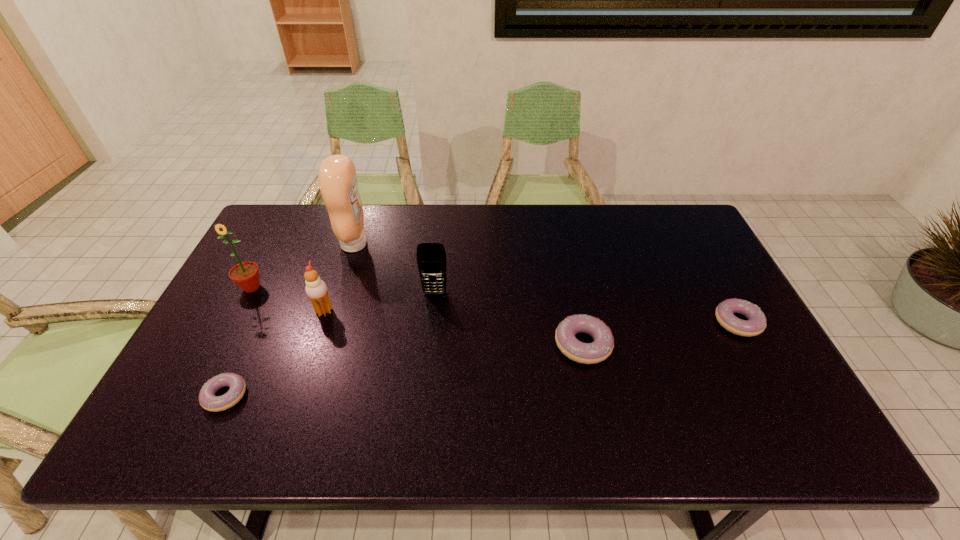
Find the location of a particular element. The width and height of the screenshot is (960, 540). icecream is located at coordinates (316, 289).

Where is `vacant space situated on the back of the nearest doughnut`? vacant space situated on the back of the nearest doughnut is located at coordinates (274, 292).

I want to click on vacant space located on the back of the sixth object from left to right, so click(x=573, y=298).

At what (x,y) coordinates should I click in order to perform the action: click on vacant position located on the left of the rightmost object. Please return your answer as a coordinate pair (x, y). The width and height of the screenshot is (960, 540). Looking at the image, I should click on (663, 322).

At what (x,y) coordinates should I click in order to perform the action: click on free location located on the face of the sixth shortest object. Please return your answer as a coordinate pair (x, y). Looking at the image, I should click on (237, 315).

At what (x,y) coordinates should I click in order to perform the action: click on free space located 0.370m on the label of the tallest object. Please return your answer as a coordinate pair (x, y). Looking at the image, I should click on (482, 244).

Locate an element on the screen. This screenshot has height=540, width=960. free space located on the screen of the cellular telephone is located at coordinates (433, 309).

In order to click on vacant space located at the front with a straw on the icecream in this screenshot , I will do `click(431, 311)`.

Locate an element on the screen. Image resolution: width=960 pixels, height=540 pixels. object that is at the far edge is located at coordinates (338, 183).

You are a GUI agent. You are given a task and a screenshot of the screen. Output one action in this format:
    pyautogui.click(x=<x>, y=<y>)
    Task: Click on the object present at the near edge
    This screenshot has width=960, height=540.
    Given the screenshot: What is the action you would take?
    pyautogui.click(x=208, y=400)